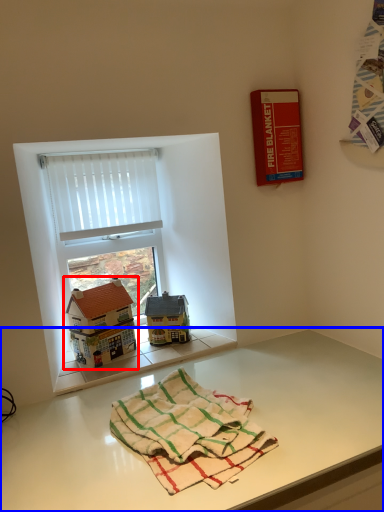
Question: Which object is further to the camera taking this photo, toy (highlighted by a red box) or table (highlighted by a blue box)?

Choices:
 (A) toy
 (B) table

Answer: (A)